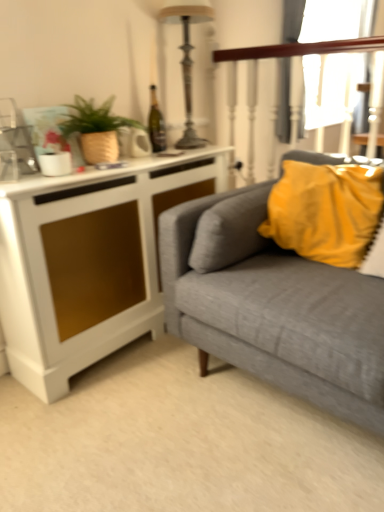
This screenshot has height=512, width=384. What do you see at coordinates (325, 211) in the screenshot?
I see `yellow fabric pillow at upper right` at bounding box center [325, 211].

What do you see at coordinates (96, 129) in the screenshot?
I see `matte brown pot at upper left` at bounding box center [96, 129].

Locate an element on the screen. This screenshot has height=512, width=384. metallic silver lamp at upper center is located at coordinates (187, 55).

What is the approximate height of white matte cabinet at left?

white matte cabinet at left is 32.92 inches in height.

Describe the element at coordinates (88, 261) in the screenshot. Image resolution: width=384 pixels, height=512 pixels. I see `white matte cabinet at left` at that location.

Identify the location of wooden polished rail at upper right. Image resolution: width=384 pixels, height=512 pixels. (278, 57).

From the image's perspective, is white matte cabinet at left under metallic silver lamp at upper center?

Yes.

In the scene shown: In terms of width, does white matte cabinet at left look wider or thinner when compared to metallic silver lamp at upper center?

Clearly, white matte cabinet at left has more width compared to metallic silver lamp at upper center.

Considering the sizes of objects white matte cabinet at left and metallic silver lamp at upper center in the image provided, who is bigger, white matte cabinet at left or metallic silver lamp at upper center?

white matte cabinet at left is bigger.

In the scene shown: Which of these two, white matte cabinet at left or metallic silver lamp at upper center, stands taller?

white matte cabinet at left is taller.

Considering the positions of point (296, 219) and point (357, 47), is point (296, 219) closer or farther from the camera than point (357, 47)?

Point (296, 219) appears to be closer to the viewer than point (357, 47).

From a real-world perspective, is yellow fabric pillow at upper right below wooden polished rail at upper right?

Correct, in the physical world, yellow fabric pillow at upper right is lower than wooden polished rail at upper right.

How different are the orientations of yellow fabric pillow at upper right and wooden polished rail at upper right in degrees?

A: The facing directions of yellow fabric pillow at upper right and wooden polished rail at upper right are 156 degrees apart.

I want to click on pillow beneath the wooden polished rail at upper right (from a real-world perspective), so click(325, 211).

Consider the image. Can textured gray couch at right be found inside yellow fabric pillow at upper right?

Definitely not — textured gray couch at right is not inside yellow fabric pillow at upper right.

Considering the relative sizes of yellow fabric pillow at upper right and textured gray couch at right in the image provided, is yellow fabric pillow at upper right thinner than textured gray couch at right?

Yes.

Is yellow fabric pillow at upper right turned away from textured gray couch at right?

That's right, yellow fabric pillow at upper right is facing away from textured gray couch at right.

Would you say matte brown pot at upper left is outside metallic silver lamp at upper center?

Yes, matte brown pot at upper left is not within metallic silver lamp at upper center.

Is point (67, 129) in front of point (178, 140)?

Yes, point (67, 129) is closer to viewer.

The image size is (384, 512). I want to click on houseplant in front of the metallic silver lamp at upper center, so click(96, 129).

Are matte brown pot at upper left and metallic silver lamp at upper center located far from each other?

No, there isn't a large distance between matte brown pot at upper left and metallic silver lamp at upper center.

Which of these two, matte brown pot at upper left or white matte cabinet at left, is bigger?

white matte cabinet at left is bigger.

From the image's perspective, who appears lower, matte brown pot at upper left or white matte cabinet at left?

white matte cabinet at left, from the image's perspective.

Could you tell me if matte brown pot at upper left is facing white matte cabinet at left?

No, matte brown pot at upper left is not facing towards white matte cabinet at left.

Would you say matte brown pot at upper left contains white matte cabinet at left?

No, white matte cabinet at left is not surrounded by matte brown pot at upper left.

From the picture: In the image, is metallic silver lamp at upper center positioned in front of or behind white matte cabinet at left?

metallic silver lamp at upper center is behind white matte cabinet at left.

Is metallic silver lamp at upper center spatially inside white matte cabinet at left, or outside of it?

metallic silver lamp at upper center is located beyond the bounds of white matte cabinet at left.

Considering the relative positions of metallic silver lamp at upper center and white matte cabinet at left in the image provided, is metallic silver lamp at upper center to the left or to the right of white matte cabinet at left?

metallic silver lamp at upper center is to the right of white matte cabinet at left.

Is metallic silver lamp at upper center wider than white matte cabinet at left?

Incorrect, the width of metallic silver lamp at upper center does not surpass that of white matte cabinet at left.

Which point is more distant from viewer, (x=267, y=50) or (x=308, y=167)?

Answer: Positioned behind is point (x=267, y=50).

How many degrees apart are the facing directions of wooden polished rail at upper right and yellow fabric pillow at upper right?

156 degrees separate the facing orientations of wooden polished rail at upper right and yellow fabric pillow at upper right.

From the image's perspective, is wooden polished rail at upper right above or below yellow fabric pillow at upper right?

Based on their image positions, wooden polished rail at upper right is located above yellow fabric pillow at upper right.

Considering the relative sizes of wooden polished rail at upper right and yellow fabric pillow at upper right in the image provided, is wooden polished rail at upper right smaller than yellow fabric pillow at upper right?

Indeed, wooden polished rail at upper right has a smaller size compared to yellow fabric pillow at upper right.

Identify the location of cabinetry on the left of metallic silver lamp at upper center. Image resolution: width=384 pixels, height=512 pixels. (88, 261).

You are a GUI agent. You are given a task and a screenshot of the screen. Output one action in this format:
    pyautogui.click(x=<x>, y=<y>)
    Task: Click on the rail located above the yellow fabric pillow at upper right (from the image's perspective)
    
    Given the screenshot: What is the action you would take?
    pyautogui.click(x=278, y=57)

When comparing their distances from white matte cabinet at left, does textured gray couch at right or matte brown pot at upper left seem further?

textured gray couch at right lies further to white matte cabinet at left than the other object.

Looking at the image, which one is located further to white matte cabinet at left, wooden polished rail at upper right or metallic silver lamp at upper center?

wooden polished rail at upper right.

Based on their spatial positions, is white matte cabinet at left or matte brown pot at upper left closer to metallic silver lamp at upper center?

matte brown pot at upper left.

Considering their positions, is matte brown pot at upper left positioned further to yellow fabric pillow at upper right than white matte cabinet at left?

Based on the image, matte brown pot at upper left appears to be further to yellow fabric pillow at upper right.

Looking at the image, which one is located further to wooden polished rail at upper right, metallic silver lamp at upper center or white matte cabinet at left?

white matte cabinet at left is further to wooden polished rail at upper right.

Estimate the real-world distances between objects in this image. Which object is closer to yellow fabric pillow at upper right, wooden polished rail at upper right or metallic silver lamp at upper center?

wooden polished rail at upper right lies closer to yellow fabric pillow at upper right than the other object.

Which object lies nearer to the anchor point white matte cabinet at left, yellow fabric pillow at upper right or wooden polished rail at upper right?

The object closer to white matte cabinet at left is yellow fabric pillow at upper right.

Which object lies nearer to the anchor point matte brown pot at upper left, yellow fabric pillow at upper right or wooden polished rail at upper right?

wooden polished rail at upper right.

Identify the location of cabinetry between matte brown pot at upper left and yellow fabric pillow at upper right. [x=88, y=261].

Find the location of `pillow between metallic silver lamp at upper center and white matte cabinet at left in the vertical direction`. pillow between metallic silver lamp at upper center and white matte cabinet at left in the vertical direction is located at coordinates (325, 211).

You are a GUI agent. You are given a task and a screenshot of the screen. Output one action in this format:
    pyautogui.click(x=<x>, y=<y>)
    Task: Click on the pillow between metallic silver lamp at upper center and textured gray couch at right vertically
    This screenshot has width=384, height=512.
    Given the screenshot: What is the action you would take?
    pyautogui.click(x=325, y=211)

At what (x,y) coordinates should I click in order to perform the action: click on rail between metallic silver lamp at upper center and yellow fabric pillow at upper right vertically. Please return your answer as a coordinate pair (x, y). Looking at the image, I should click on (278, 57).